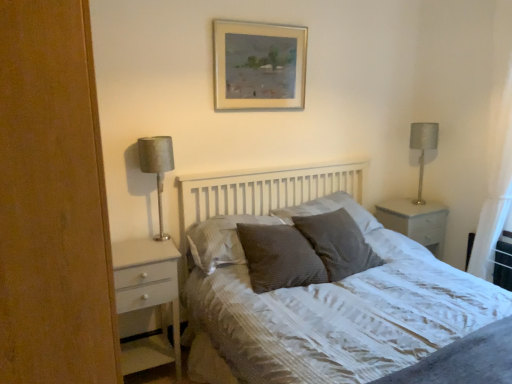
The image size is (512, 384). What are the coordinates of `vacant area on top of white glossy chest of drawers at left (from a real-world perspective)` in the screenshot? It's located at (140, 253).